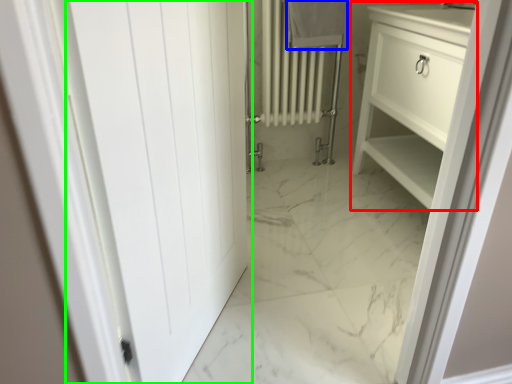
Question: Based on their relative distances, which object is farther from bathroom cabinet (highlighted by a red box)? Choose from bath towel (highlighted by a blue box) and door (highlighted by a green box).

Choices:
 (A) bath towel
 (B) door

Answer: (B)